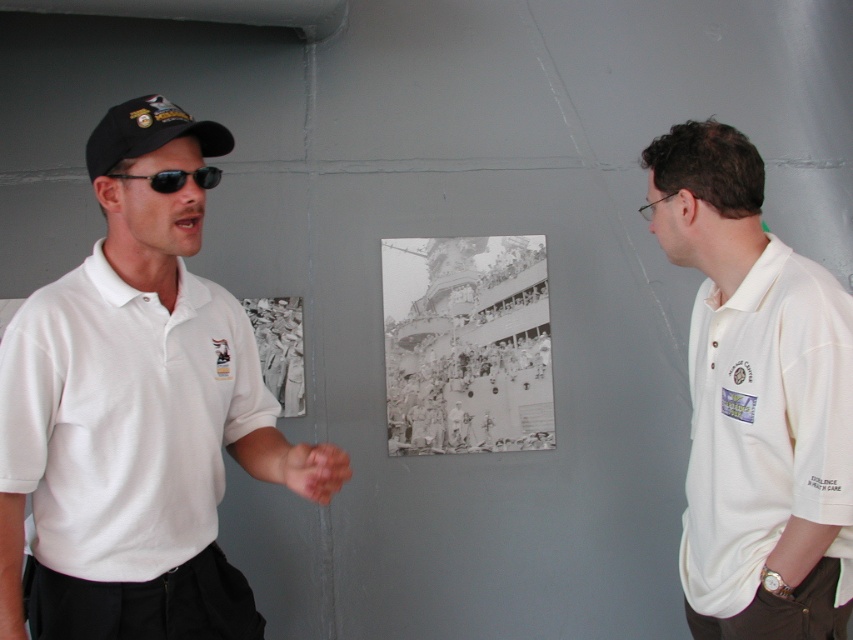
Question: Which object is positioned farthest from the pink flesh-toned hand at center?

Choices:
 (A) white cotton polo shirt at right
 (B) black reflective sunglasses at left
 (C) black fabric baseball cap at left

Answer: (A)

Question: Can you confirm if white cotton polo shirt at right is thinner than black fabric baseball cap at left?

Choices:
 (A) yes
 (B) no

Answer: (B)

Question: Which point is closer to the camera taking this photo?

Choices:
 (A) (276, 467)
 (B) (715, 432)
 (C) (152, 552)
 (D) (209, 147)

Answer: (C)

Question: Which of the following is the farthest from the observer?

Choices:
 (A) (780, 458)
 (B) (293, 465)
 (C) (212, 579)

Answer: (A)

Question: Is white matte shirt at left smaller than black fabric baseball cap at left?

Choices:
 (A) no
 (B) yes

Answer: (A)

Question: Can you confirm if white matte shirt at left is positioned below black reflective sunglasses at left?

Choices:
 (A) yes
 (B) no

Answer: (A)